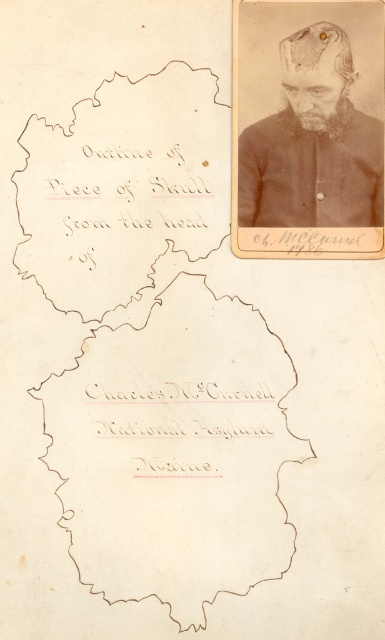
You are an archaeologist examining the historical document. You need to determine if the brown paper map at center can be placed on a shelf that is narrower than the dark brown hair at upper right. Can it fit?

The brown paper map at center might be wider than the dark brown hair at upper right, so it may not fit on the shelf if the shelf is narrower than the dark brown hair at upper right.

You are an archaeologist examining this historical document. You need to locate the brown paper map at center. Where would you find it in relation to the photograph and the skull outline?

The brown paper map at center is located at point coordinates (175, 445). Based on the coordinates, it is positioned between the photograph on the right and the skull outline on the left.